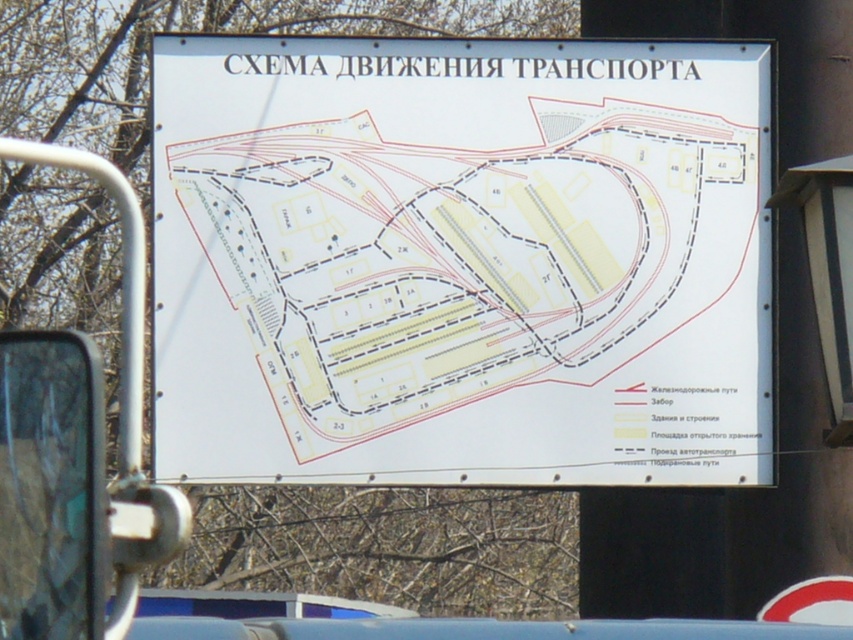
Question: Which of the following is the closest to the observer?

Choices:
 (A) (752, 616)
 (B) (184, 452)

Answer: (A)

Question: Does white paper sign at center have a greater width compared to white plastic sign at upper center?

Choices:
 (A) yes
 (B) no

Answer: (A)

Question: Is white paper sign at center below white plastic sign at upper center?

Choices:
 (A) no
 (B) yes

Answer: (A)

Question: Among these objects, which one is nearest to the camera?

Choices:
 (A) white plastic sign at upper center
 (B) white paper sign at center

Answer: (B)

Question: Is white paper sign at center behind white plastic sign at upper center?

Choices:
 (A) no
 (B) yes

Answer: (A)